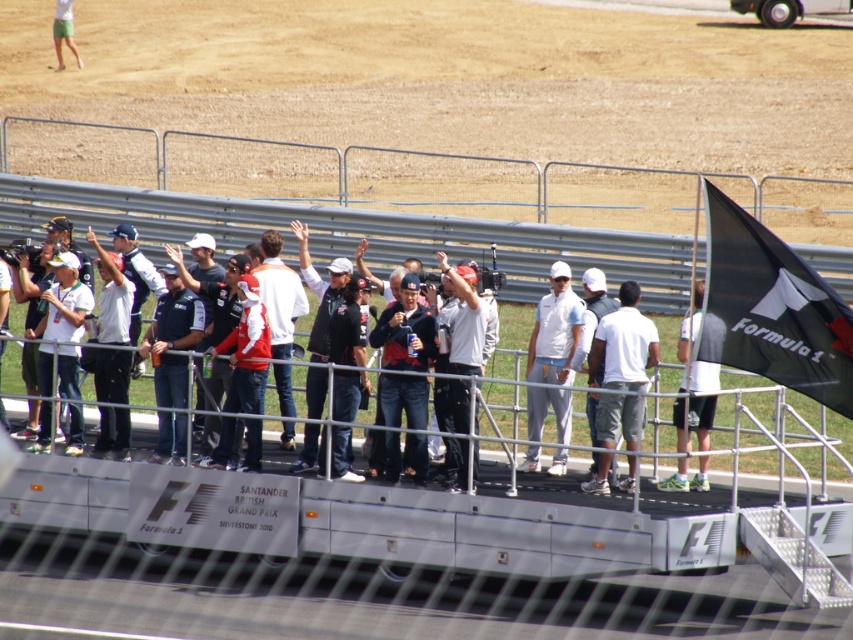
Question: Among these objects, which one is nearest to the camera?

Choices:
 (A) white fabric cap at center
 (B) white cotton shirt at center
 (C) black fabric flag at right

Answer: (C)

Question: Which object is farther from the camera taking this photo?

Choices:
 (A) white cotton shirt at center
 (B) white matte shirt at center
 (C) reddish-white fabric jacket at center
 (D) white fabric cap at center

Answer: (B)

Question: Can you confirm if black fabric flag at right is bigger than white cotton shirt at center?

Choices:
 (A) yes
 (B) no

Answer: (B)

Question: Does white cotton shirt at center appear over white matte shirt at center?

Choices:
 (A) no
 (B) yes

Answer: (A)

Question: Which point is farther to the camera?

Choices:
 (A) white fabric cap at center
 (B) reddish-white fabric jacket at center

Answer: (B)

Question: Considering the relative positions of black fabric flag at right and reddish-white fabric jacket at center in the image provided, where is black fabric flag at right located with respect to reddish-white fabric jacket at center?

Choices:
 (A) above
 (B) below

Answer: (A)